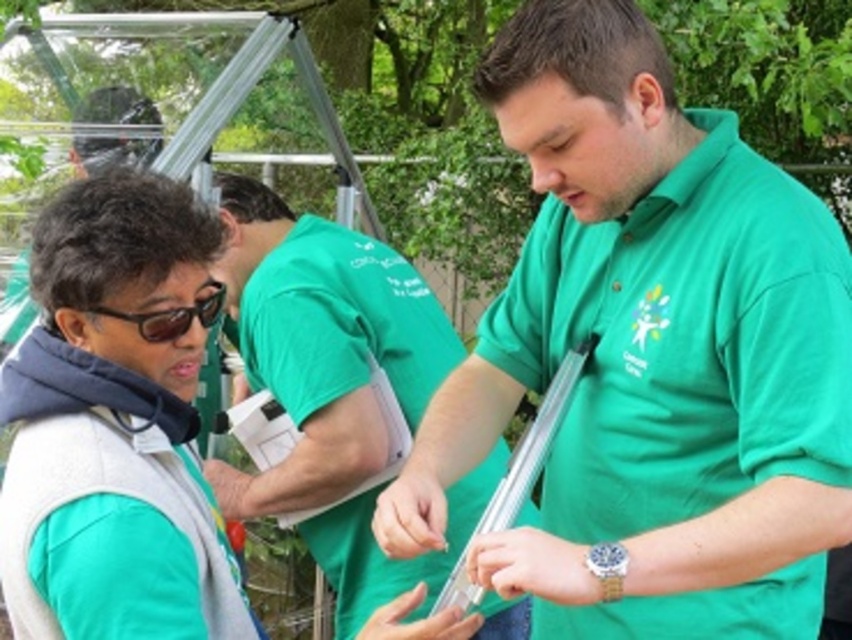
In the scene shown: Who is positioned more to the left, green fabric shirt at center or black plastic goggles at upper left?

From the viewer's perspective, black plastic goggles at upper left appears more on the left side.

From the picture: Between green fabric shirt at center and black plastic goggles at upper left, which one appears on the right side from the viewer's perspective?

green fabric shirt at center

Does point (280, 276) come closer to viewer compared to point (171, 330)?

No, it is not.

I want to click on green fabric shirt at center, so click(x=321, y=342).

Does green matte shirt at center have a lesser width compared to green fabric shirt at center?

Yes.

Who is more distant from viewer, (735, 449) or (337, 310)?

The point (337, 310) is more distant.

Locate an element on the screen. green matte shirt at center is located at coordinates (649, 355).

Can you confirm if green matte shirt at center is taller than black plastic goggles at upper left?

Yes, green matte shirt at center is taller than black plastic goggles at upper left.

Locate an element on the screen. This screenshot has height=640, width=852. green matte shirt at center is located at coordinates (649, 355).

At what (x,y) coordinates should I click in order to perform the action: click on green matte shirt at center. Please return your answer as a coordinate pair (x, y). The height and width of the screenshot is (640, 852). Looking at the image, I should click on (649, 355).

Where is `green matte shirt at center`? This screenshot has height=640, width=852. green matte shirt at center is located at coordinates [x=649, y=355].